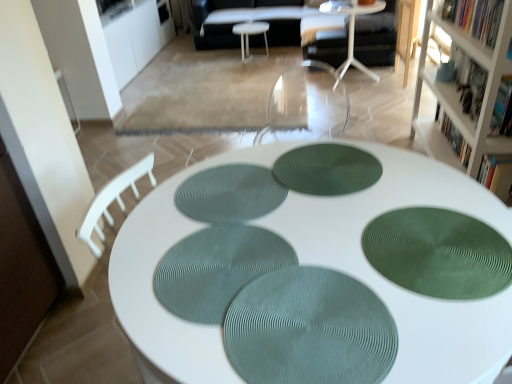
The width and height of the screenshot is (512, 384). Find the location of `free space above green textured mat at lower right, acting as the fourth mat starting from the left (from a real-world perspective)`. free space above green textured mat at lower right, acting as the fourth mat starting from the left (from a real-world perspective) is located at coordinates (433, 246).